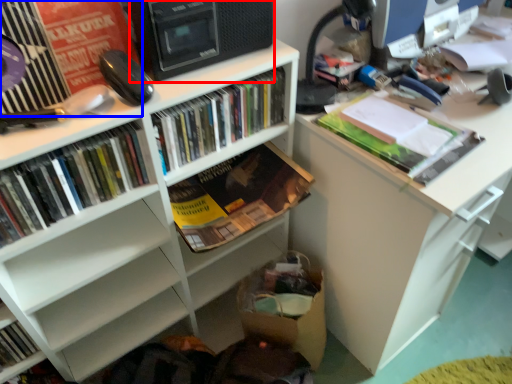
Question: Which point is closer to the camera, computer tower (highlighted by a red box) or shelf (highlighted by a blue box)?

Choices:
 (A) computer tower
 (B) shelf

Answer: (B)